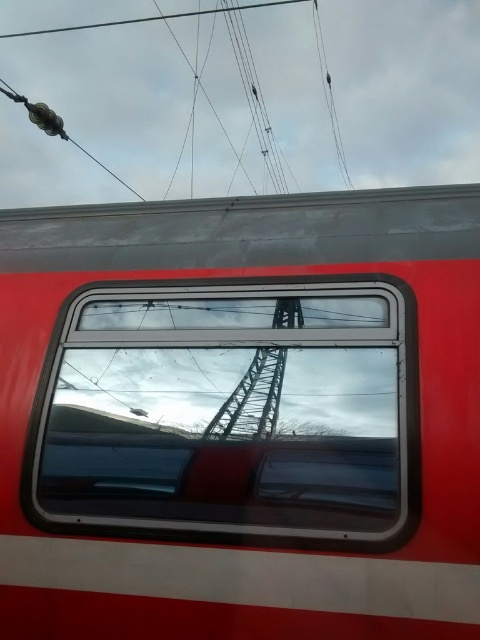
Which is above, clear glass window at center or metallic wire at upper center?

metallic wire at upper center

Which is behind, point (64, 486) or point (103, 200)?

The point (103, 200) is more distant.

Where is `clear glass window at center`? This screenshot has height=640, width=480. clear glass window at center is located at coordinates (230, 410).

Where is `clear glass window at center`? clear glass window at center is located at coordinates (230, 410).

Is point (454, 330) positioned before point (321, 532)?

No, it is not.

Does metallic red train window at center have a smaller size compared to clear glass window at center?

Actually, metallic red train window at center might be larger than clear glass window at center.

Which is in front, point (79, 502) or point (133, 344)?

Point (79, 502)

Locate an element on the screen. Image resolution: width=480 pixels, height=640 pixels. metallic red train window at center is located at coordinates (241, 417).

Is metallic red train window at center positioned at the back of metallic wire at upper center?

No.

Does metallic red train window at center have a larger size compared to metallic wire at upper center?

Yes.

The image size is (480, 640). I want to click on metallic red train window at center, so click(x=241, y=417).